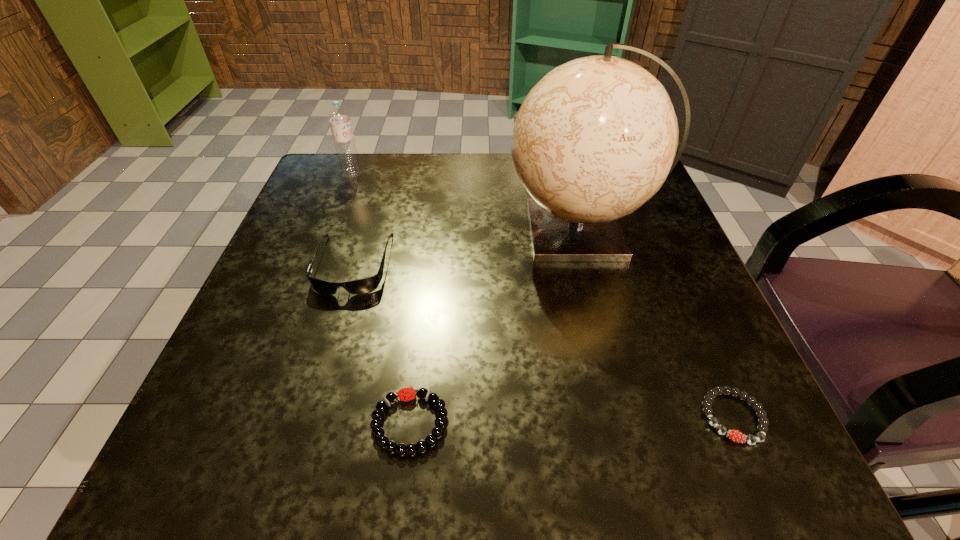
Locate an element on the screen. empty space between the farthest object and the third tallest object is located at coordinates (352, 218).

Locate an element on the screen. This screenshot has height=540, width=960. empty space that is in between the third tallest object and the third object from left to right is located at coordinates (381, 343).

Where is `free area in between the tallest object and the shortest object`? This screenshot has width=960, height=540. free area in between the tallest object and the shortest object is located at coordinates (657, 324).

I want to click on free area in between the tallest object and the right bracelet, so click(657, 324).

Locate an element on the screen. Image resolution: width=960 pixels, height=540 pixels. empty location between the water bottle and the tallest object is located at coordinates click(x=467, y=202).

Identify the location of free space that is in between the taller bracelet and the globe. (495, 327).

Locate an element on the screen. The image size is (960, 540). free point between the sunglasses and the third object from left to right is located at coordinates (381, 343).

I want to click on vacant area that lies between the taller bracelet and the farthest object, so click(381, 298).

Find the location of a particular element. The height and width of the screenshot is (540, 960). free spot between the globe and the left bracelet is located at coordinates (495, 327).

Identify which object is the closest to the second shortest object. Please provide its 2D coordinates. Your answer should be formatted as a tuple, i.e. [(x, y)], where the tuple contains the x and y coordinates of a point satisfying the conditions above.

[(366, 285)]